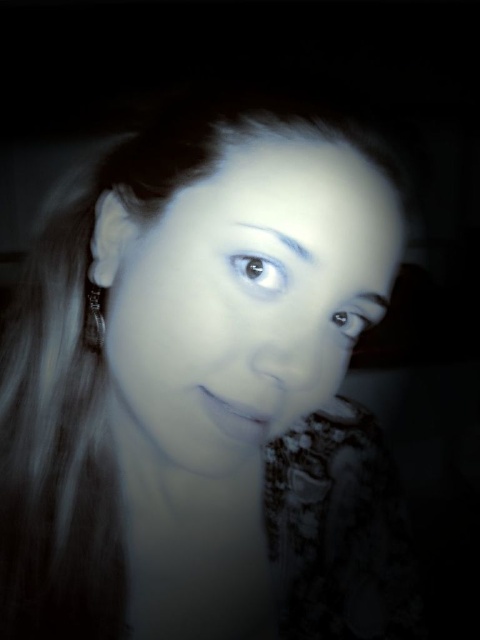
You are a photographer trying to adjust the lighting in the scene to ensure both the smooth skin face at center and the silver metallic earring at left are clearly visible. Given the current contrast, which object might be more challenging to properly expose for and why?

The silver metallic earring at left might be more challenging to properly expose for because it is smaller than the smooth skin face at center, making it harder to balance the lighting between the two objects in such a high contrast environment.

You are a photographer adjusting lighting for a portrait. You notice the smooth skin face at center and the shiny black eye at upper right. Which object is positioned higher in the image?

The smooth skin face at center is taller than the shiny black eye at upper right, so the smooth skin face at center is positioned higher in the image.

You are a photographer analyzing the lighting in this image. You notice the silver metallic earring at left and the shiny black eye at upper right. Which object is positioned higher up in the image?

The silver metallic earring at left is located above the shiny black eye at upper right, so it is positioned higher up in the image.